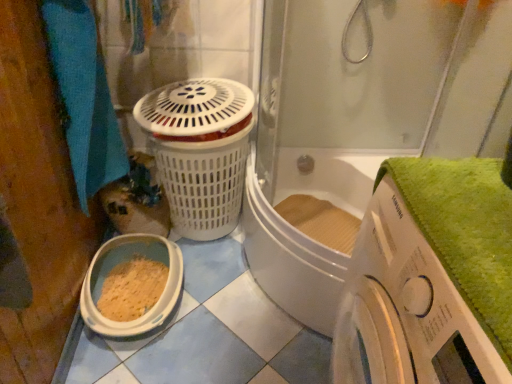
Question: In which direction should I rotate to look at transparent glass shower door at upper center?

Choices:
 (A) left
 (B) right

Answer: (B)

Question: Is blue fabric towel at left taller than transparent glass shower door at upper center?

Choices:
 (A) yes
 (B) no

Answer: (B)

Question: Is blue fabric towel at left wider than transparent glass shower door at upper center?

Choices:
 (A) yes
 (B) no

Answer: (B)

Question: From a real-world perspective, is blue fabric towel at left physically below transparent glass shower door at upper center?

Choices:
 (A) no
 (B) yes

Answer: (A)

Question: Is blue fabric towel at left at the left side of transparent glass shower door at upper center?

Choices:
 (A) no
 (B) yes

Answer: (B)

Question: Is blue fabric towel at left positioned behind transparent glass shower door at upper center?

Choices:
 (A) no
 (B) yes

Answer: (B)

Question: From a real-world perspective, is blue fabric towel at left on top of transparent glass shower door at upper center?

Choices:
 (A) yes
 (B) no

Answer: (A)

Question: From the image's perspective, is transparent glass shower door at upper center below white plastic washing machine at lower right?

Choices:
 (A) yes
 (B) no

Answer: (B)

Question: Is white plastic washing machine at lower right at the back of transparent glass shower door at upper center?

Choices:
 (A) yes
 (B) no

Answer: (B)

Question: Considering the relative sizes of transparent glass shower door at upper center and white plastic washing machine at lower right in the image provided, is transparent glass shower door at upper center thinner than white plastic washing machine at lower right?

Choices:
 (A) no
 (B) yes

Answer: (A)

Question: Is transparent glass shower door at upper center bigger than white plastic washing machine at lower right?

Choices:
 (A) yes
 (B) no

Answer: (A)

Question: From a real-world perspective, does transparent glass shower door at upper center sit lower than white plastic washing machine at lower right?

Choices:
 (A) yes
 (B) no

Answer: (B)

Question: Is transparent glass shower door at upper center aimed at white plastic washing machine at lower right?

Choices:
 (A) no
 (B) yes

Answer: (A)

Question: Is the position of blue fabric towel at left more distant than that of white plastic washing machine at lower right?

Choices:
 (A) yes
 (B) no

Answer: (A)